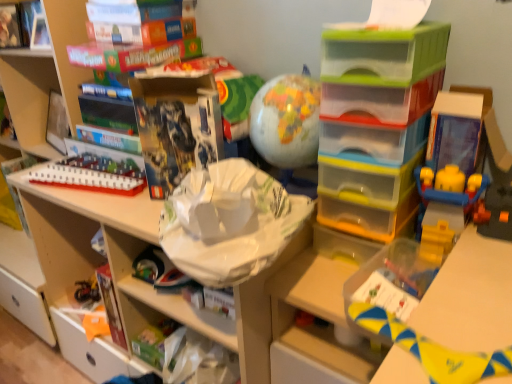
Question: Is white plastic train at upper left, which is counted as the 1th toy, starting from the back, taller than matte cardboard book at upper left, placed as the 3th book when sorted from left to right?

Choices:
 (A) no
 (B) yes

Answer: (A)

Question: Is matte cardboard book at upper left, placed as the 3th book when sorted from left to right, a part of white plastic train at upper left, which ranks as the third toy in right-to-left order?

Choices:
 (A) yes
 (B) no

Answer: (B)

Question: Does white plastic train at upper left, which ranks as the third toy in right-to-left order, turn towards matte cardboard book at upper left, the 3th book from the right?

Choices:
 (A) yes
 (B) no

Answer: (B)

Question: Is white plastic train at upper left, arranged as the third toy when viewed from the front, behind matte cardboard book at upper left, the 3th book from the right?

Choices:
 (A) no
 (B) yes

Answer: (A)

Question: Does white plastic train at upper left, which is counted as the 1th toy, starting from the back, have a larger size compared to matte cardboard book at upper left, placed as the 3th book when sorted from left to right?

Choices:
 (A) yes
 (B) no

Answer: (B)

Question: Is point (478, 354) closer or farther from the camera than point (5, 168)?

Choices:
 (A) closer
 (B) farther

Answer: (A)

Question: In terms of size, does yellow fabric toy at lower right, which is counted as the first toy, starting from the bottom, appear bigger or smaller than transparent plastic tray at left, which is the 5th book from right to left?

Choices:
 (A) big
 (B) small

Answer: (B)

Question: Is yellow fabric toy at lower right, the third toy positioned from the back, in front of or behind transparent plastic tray at left, which is counted as the 1th book, starting from the left, in the image?

Choices:
 (A) front
 (B) behind

Answer: (A)

Question: From the image's perspective, is yellow fabric toy at lower right, the third toy positioned from the back, located above or below transparent plastic tray at left, which is counted as the 1th book, starting from the left?

Choices:
 (A) below
 (B) above

Answer: (A)

Question: From the image's perspective, is white plastic bookshelf at left positioned above or below matte cardboard book at upper left, the 3th book from the right?

Choices:
 (A) below
 (B) above

Answer: (A)

Question: Which is correct: white plastic bookshelf at left is inside matte cardboard book at upper left, the 3th book from the right, or outside of it?

Choices:
 (A) outside
 (B) inside

Answer: (A)

Question: Based on their sizes in the image, would you say white plastic bookshelf at left is bigger or smaller than matte cardboard book at upper left, placed as the 3th book when sorted from left to right?

Choices:
 (A) small
 (B) big

Answer: (B)

Question: In terms of width, does white plastic bookshelf at left look wider or thinner when compared to matte cardboard book at upper left, placed as the 3th book when sorted from left to right?

Choices:
 (A) thin
 (B) wide

Answer: (B)

Question: From their relative heights in the image, would you say yellow fabric toy at lower right, the first toy viewed from the front, is taller or shorter than white cardboard shelf at upper left, acting as the 2th shelf starting from the right?

Choices:
 (A) short
 (B) tall

Answer: (A)

Question: Considering the positions of point (370, 327) and point (224, 271), is point (370, 327) closer or farther from the camera than point (224, 271)?

Choices:
 (A) farther
 (B) closer

Answer: (B)